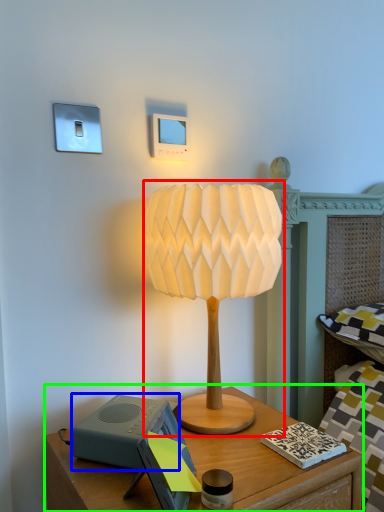
Question: Estimate the real-world distances between objects in this image. Which object is farther from lamp (highlighted by a red box), speaker (highlighted by a blue box) or nightstand (highlighted by a green box)?

Choices:
 (A) speaker
 (B) nightstand

Answer: (B)